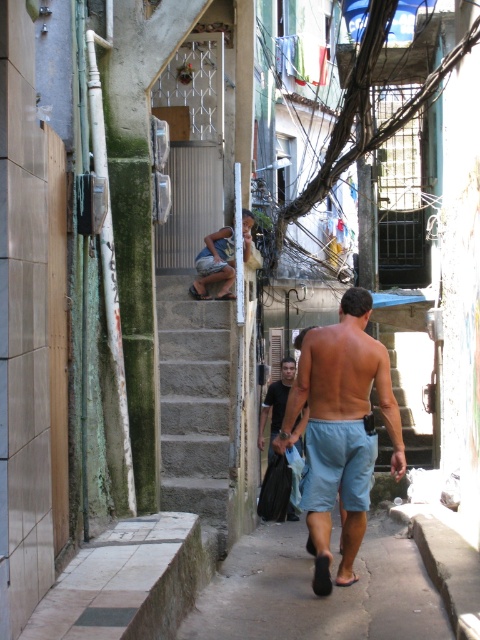
Does light blue cotton shorts at center have a greater height compared to gray concrete stairs at center?

In fact, light blue cotton shorts at center may be shorter than gray concrete stairs at center.

Is light blue cotton shorts at center bigger than gray concrete stairs at center?

Incorrect, light blue cotton shorts at center is not larger than gray concrete stairs at center.

Which is behind, point (316, 385) or point (190, 344)?

The point (190, 344) is behind.

The width and height of the screenshot is (480, 640). I want to click on light blue cotton shorts at center, so click(340, 429).

Who is lower down, light blue cotton shorts at center or dark blue shorts at center?

light blue cotton shorts at center is below.

Between light blue cotton shorts at center and dark blue shorts at center, which one appears on the right side from the viewer's perspective?

Positioned to the right is light blue cotton shorts at center.

Which is in front, point (305, 444) or point (297, 420)?

Point (305, 444)

Find the location of a particular element. light blue cotton shorts at center is located at coordinates (340, 429).

Does light blue cotton shorts at center have a larger size compared to light blue denim shorts at center?

Yes, light blue cotton shorts at center is bigger than light blue denim shorts at center.

Which of these two, light blue cotton shorts at center or light blue denim shorts at center, stands taller?

light blue cotton shorts at center is taller.

Locate an element on the screen. This screenshot has width=480, height=640. light blue cotton shorts at center is located at coordinates (340, 429).